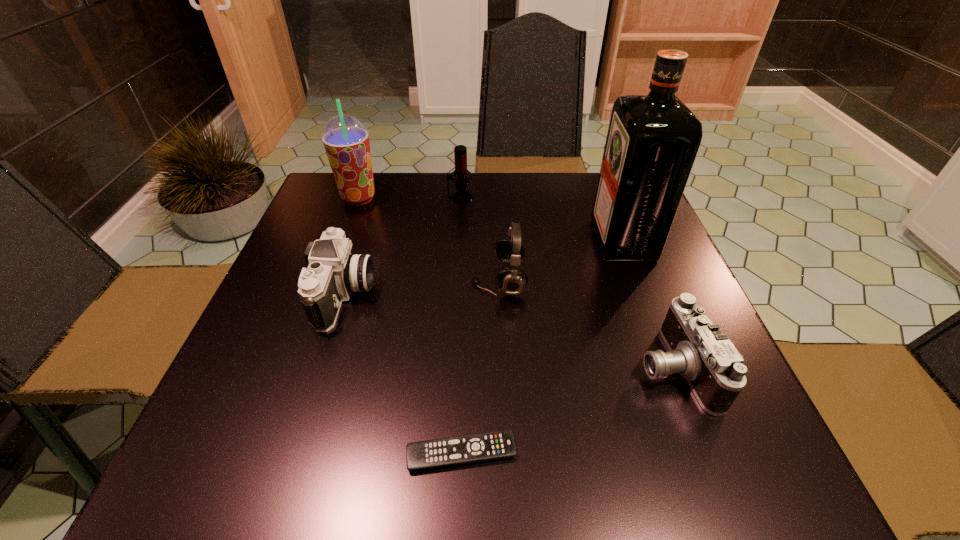
Image resolution: width=960 pixels, height=540 pixels. I want to click on free region located on the front label of the liquor, so click(x=504, y=240).

At what (x,y) coordinates should I click in order to perform the action: click on vacant space located on the front label of the liquor. Please return your answer as a coordinate pair (x, y). Looking at the image, I should click on (483, 240).

In order to click on vacant space located 0.180m on the front of the smoothie in this screenshot , I will do `click(338, 255)`.

You are a GUI agent. You are given a task and a screenshot of the screen. Output one action in this format:
    pyautogui.click(x=<x>, y=<y>)
    Task: Click on the free spot located 0.100m on the left of the microphone
    This screenshot has width=960, height=540.
    Given the screenshot: What is the action you would take?
    [410, 198]

What are the coordinates of `free spot located with the microphone on the side of the headset` in the screenshot? It's located at (356, 280).

At what (x,y) coordinates should I click in order to perform the action: click on free space located 0.180m with the microphone on the side of the headset. Please return your answer as a coordinate pair (x, y). The width and height of the screenshot is (960, 540). Looking at the image, I should click on (389, 280).

You are a GUI agent. You are given a task and a screenshot of the screen. Output one action in this format:
    pyautogui.click(x=<x>, y=<y>)
    Task: Click on the free space located with the microphone on the side of the headset
    
    Given the screenshot: What is the action you would take?
    pyautogui.click(x=407, y=280)

At what (x,y) coordinates should I click in order to perform the action: click on free point located on the left of the taller camera. Please return your answer as a coordinate pair (x, y). Looking at the image, I should click on (289, 295).

At what (x,y) coordinates should I click in order to perform the action: click on free region located at the lens of the right camera. Please return your answer as a coordinate pair (x, y). This screenshot has height=540, width=960. Looking at the image, I should click on (526, 367).

Where is `vacant space located at the lens of the right camera`? This screenshot has width=960, height=540. vacant space located at the lens of the right camera is located at coordinates (447, 367).